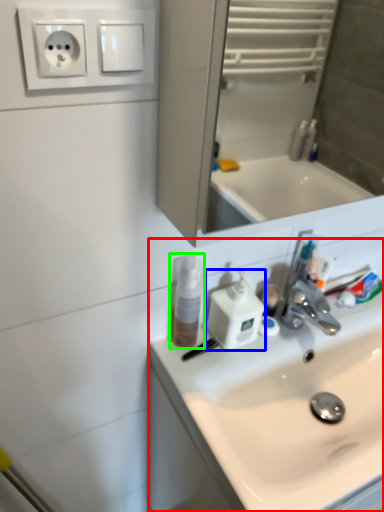
Question: Which object is the closest to the sink (highlighted by a red box)? Choose among these: soap dispenser (highlighted by a blue box) or mouthwash (highlighted by a green box).

Choices:
 (A) soap dispenser
 (B) mouthwash

Answer: (A)